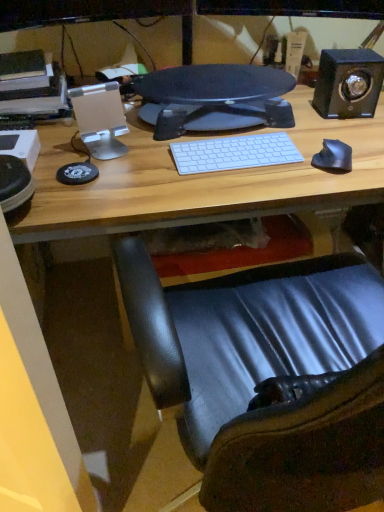
Find the location of a particular element. unoccupied area in front of black textured monitor at center is located at coordinates (198, 176).